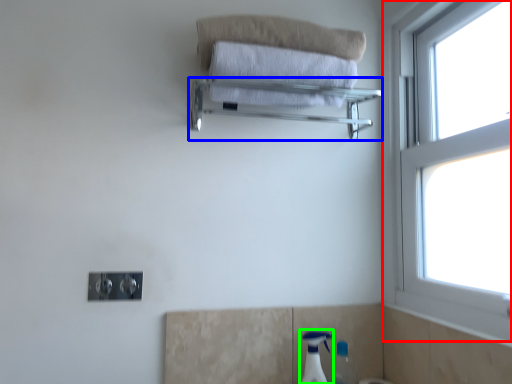
Question: Considering the real-world distances, which object is closest to window (highlighted by a red box)? balustrade (highlighted by a blue box) or soap dispenser (highlighted by a green box).

Choices:
 (A) balustrade
 (B) soap dispenser

Answer: (A)